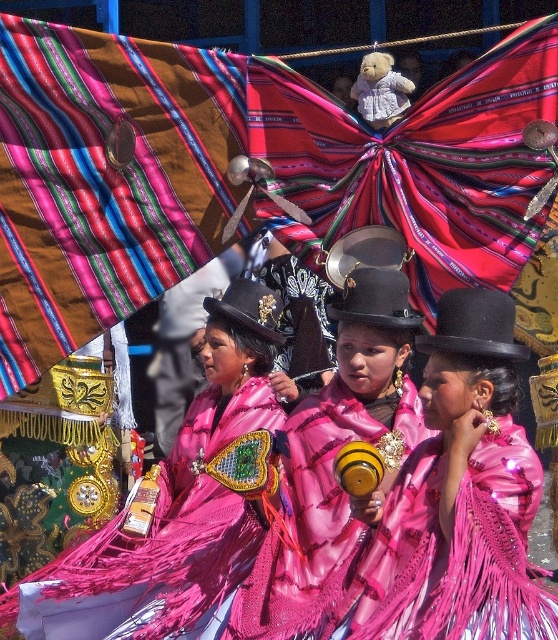
The height and width of the screenshot is (640, 558). What do you see at coordinates (363, 524) in the screenshot?
I see `pink satin maracas at center` at bounding box center [363, 524].

Between pink satin maracas at center and pink satin maraca at center, which one appears on the left side from the viewer's perspective?

pink satin maracas at center is more to the left.

Find the location of a particular element. This screenshot has width=558, height=640. pink satin maracas at center is located at coordinates (363, 524).

Locate an element on the screen. This screenshot has width=558, height=640. pink satin maracas at center is located at coordinates [x=363, y=524].

Is pink satin maracas at center wider than shiny pink dress at center?

Yes, pink satin maracas at center is wider than shiny pink dress at center.

Which of these two, pink satin maracas at center or shiny pink dress at center, stands shorter?

Standing shorter between the two is shiny pink dress at center.

At what (x,y) coordinates should I click in order to perform the action: click on pink satin maracas at center. Please return your answer as a coordinate pair (x, y). The width and height of the screenshot is (558, 640). Looking at the image, I should click on (363, 524).

Does pink satin maracas at center lie behind shiny pink fabric at center?

That is False.

Is pink satin maracas at center above shiny pink fabric at center?

Incorrect, pink satin maracas at center is not positioned above shiny pink fabric at center.

Does point (271, 632) come closer to viewer compared to point (191, 477)?

Yes, it is.

What are the coordinates of `pink satin maracas at center` in the screenshot? It's located at (363, 524).